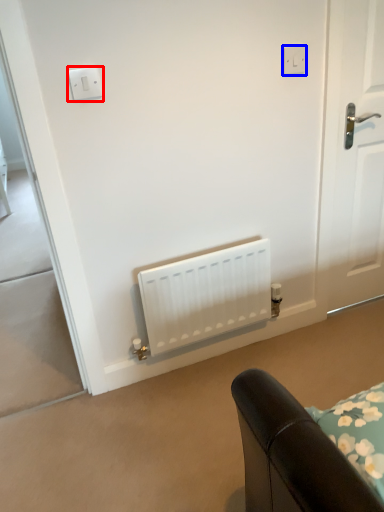
Question: Which object is closer to the camera taking this photo, light switch (highlighted by a red box) or electric outlet (highlighted by a blue box)?

Choices:
 (A) light switch
 (B) electric outlet

Answer: (A)